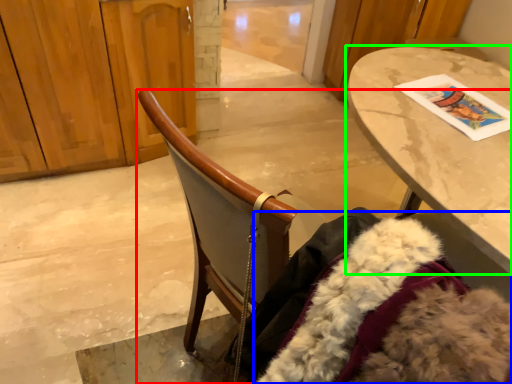
Question: Which is nearer to the chair (highlighted by a red box)? fur coat (highlighted by a blue box) or table (highlighted by a green box).

Choices:
 (A) fur coat
 (B) table

Answer: (A)